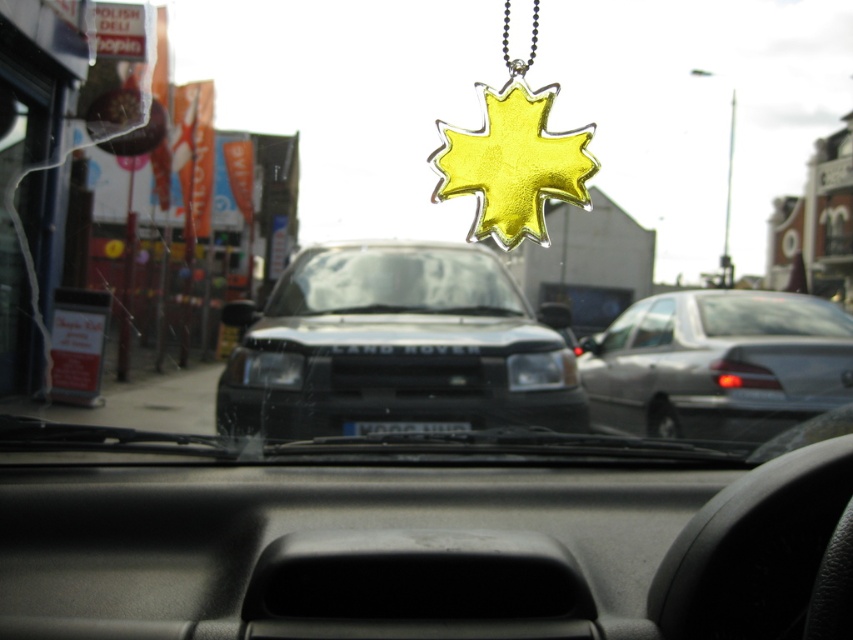
Looking at this image, you are driving a car and want to check your speed using the speedometer on the dashboard. Since the transparent glass windshield at center is in the way, can you move it out of the way to get a clear view?

The transparent glass windshield at center is positioned at point [395,282], which is part of the vehicle structure and cannot be moved. Therefore, you cannot move it out of the way to get a clear view.

You are a passenger in the car and want to know if the silver metallic sedan at right is blocking your view of the transparent glass windshield at center. Can you see through the windshield to the sedan?

The silver metallic sedan at right is in front of the transparent glass windshield at center, so you cannot see the sedan through the windshield because it is blocking the view.

You are driving a car and want to check the traffic light ahead. Which object should you look through to have a clear view of the traffic light? The transparent glass windshield at center or the clear glass car window at center?

You should look through the transparent glass windshield at center because it is positioned to the left of the clear glass car window at center, providing a more direct line of sight to the traffic light ahead.